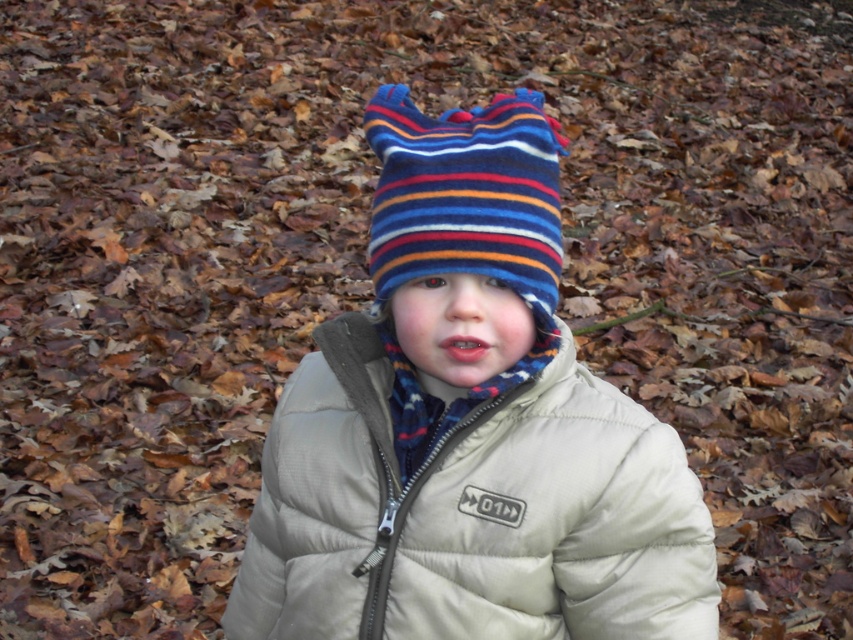
Question: Which object is farther from the camera taking this photo?

Choices:
 (A) striped woolen hat at center
 (B) beige quilted jacket at center

Answer: (B)

Question: Is beige quilted jacket at center above striped woolen hat at center?

Choices:
 (A) no
 (B) yes

Answer: (A)

Question: Is beige quilted jacket at center thinner than striped woolen hat at center?

Choices:
 (A) yes
 (B) no

Answer: (B)

Question: Does beige quilted jacket at center appear over striped woolen hat at center?

Choices:
 (A) no
 (B) yes

Answer: (A)